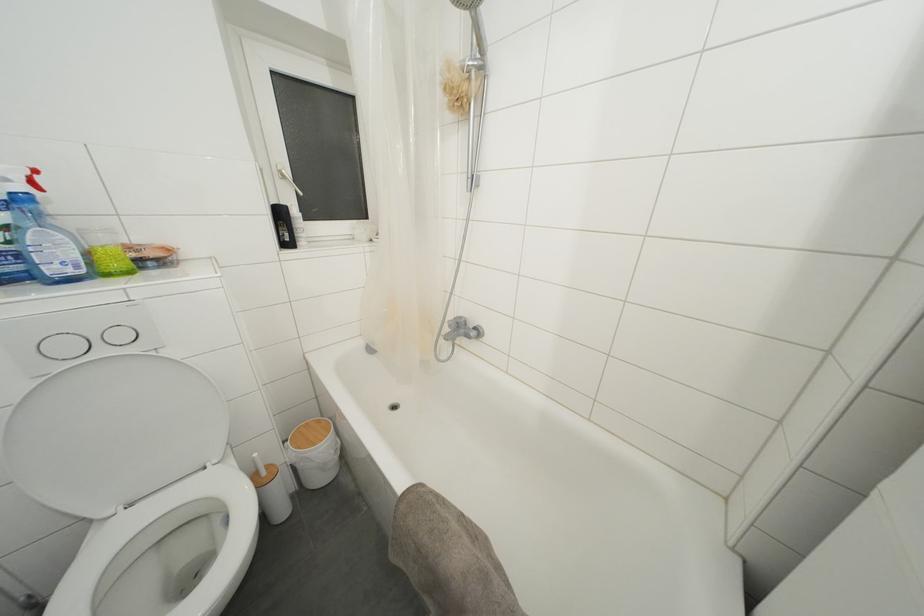
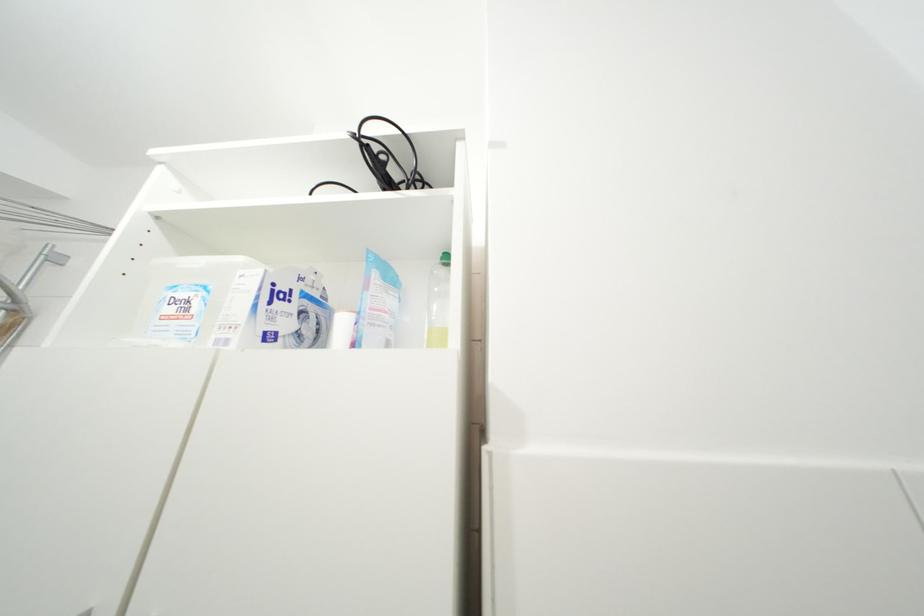
From the picture: First-person continuous shooting, in which direction is the camera rotating?

The camera's rotation is toward right-up.